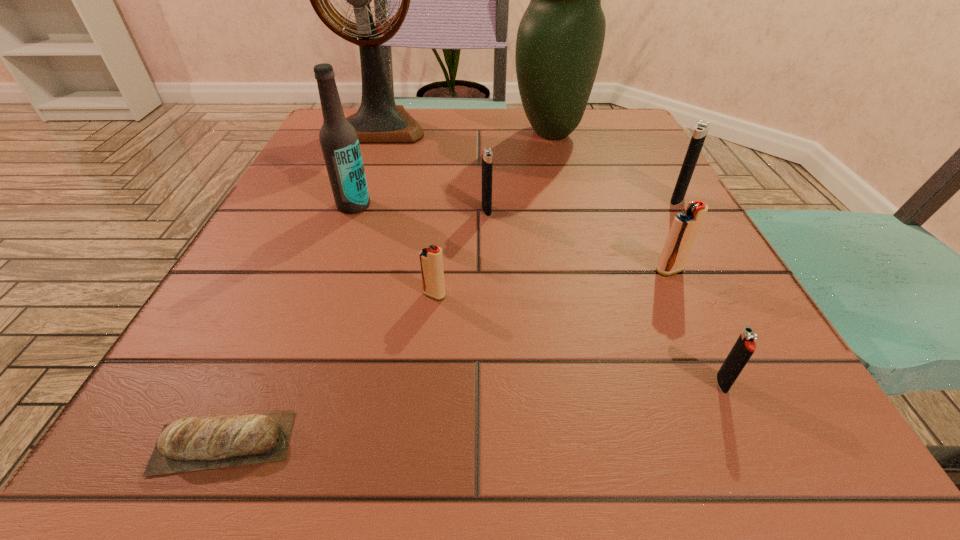
Locate an element on the screen. the third farthest igniter is located at coordinates (685, 227).

This screenshot has height=540, width=960. Identify the location of the seventh farthest object. (431, 260).

At what (x,y) coordinates should I click in order to perform the action: click on the leftmost igniter. Please return your answer as a coordinate pair (x, y). The width and height of the screenshot is (960, 540). Looking at the image, I should click on (431, 260).

Identify the location of the second black igniter from left to right. (743, 349).

The image size is (960, 540). What are the coordinates of `the second nearest object` in the screenshot? It's located at (743, 349).

This screenshot has width=960, height=540. Find the location of `the nearest object`. the nearest object is located at coordinates (228, 440).

Locate an element on the screen. the shortest object is located at coordinates (228, 440).

This screenshot has width=960, height=540. Find the location of `vacant space located on the front-facing side of the brown fan`. vacant space located on the front-facing side of the brown fan is located at coordinates (362, 174).

Find the location of a particular element. The image size is (960, 540). free point located 0.090m on the left of the green vase is located at coordinates (471, 133).

Locate an element on the screen. The image size is (960, 540). free region located 0.340m on the label of the third tallest object is located at coordinates 290,377.